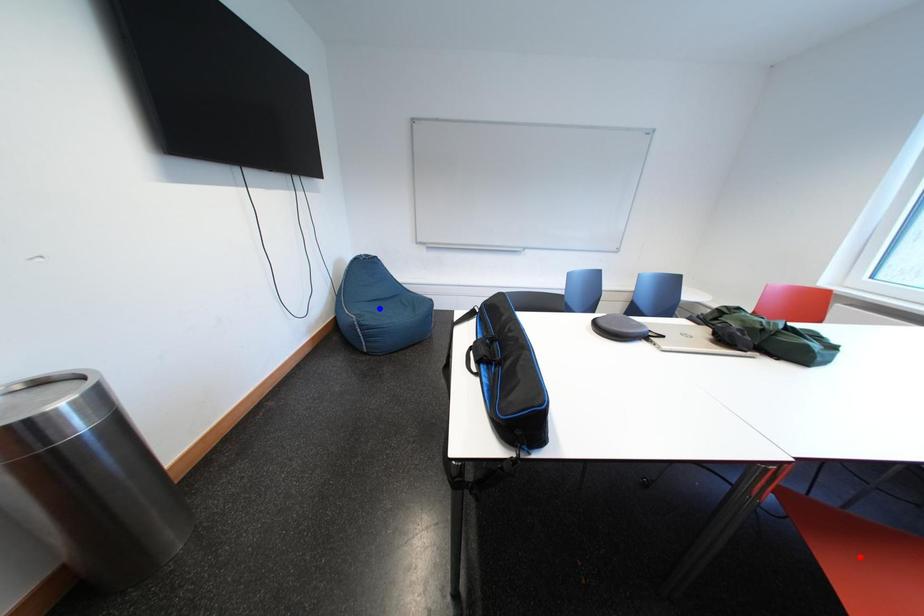
Question: Two points are marked on the image. Which point is closer to the camera?

Choices:
 (A) Blue point is closer.
 (B) Red point is closer.

Answer: (B)